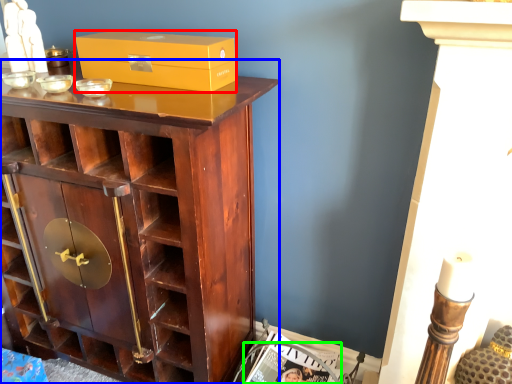
Question: Which object is the farthest from box (highlighted by a red box)? Choose among these: cupboard (highlighted by a blue box) or magazine (highlighted by a green box).

Choices:
 (A) cupboard
 (B) magazine

Answer: (B)